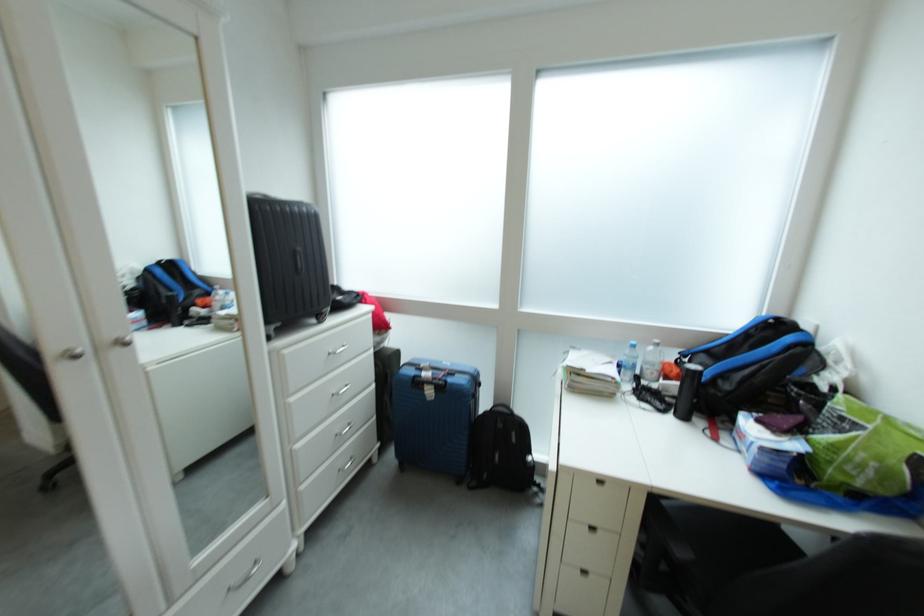
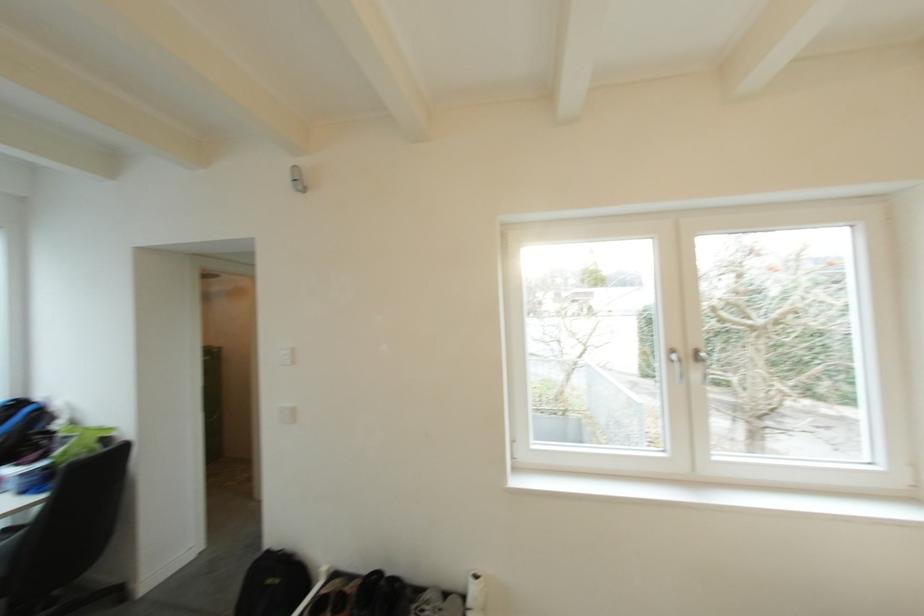
Question: I am providing you with two images of the same scene from different viewpoints. Please identify which objects are invisible in image2.

Choices:
 (A) white light switch
 (B) black backpack
 (C) blue and black backpack
 (D) none of these

Answer: (D)